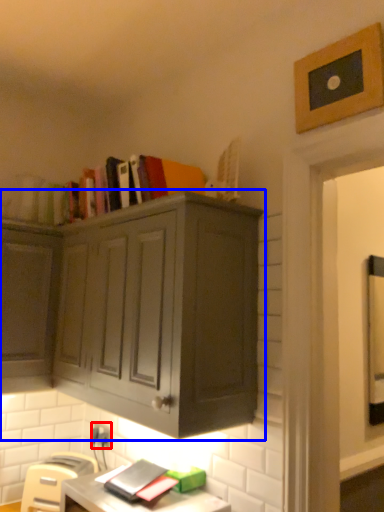
Question: Among these objects, which one is nearest to the camera, electric outlet (highlighted by a red box) or cabinetry (highlighted by a blue box)?

Choices:
 (A) electric outlet
 (B) cabinetry

Answer: (B)